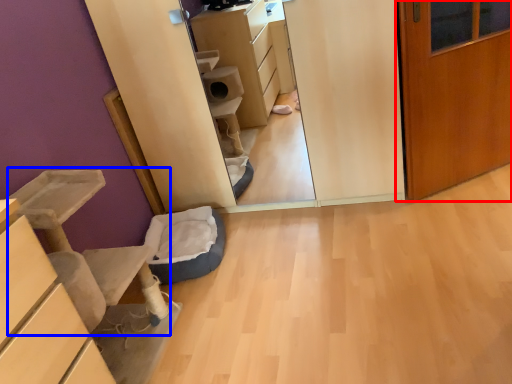
Question: Which point is further to the camera, door (highlighted by a red box) or furniture (highlighted by a blue box)?

Choices:
 (A) door
 (B) furniture

Answer: (A)